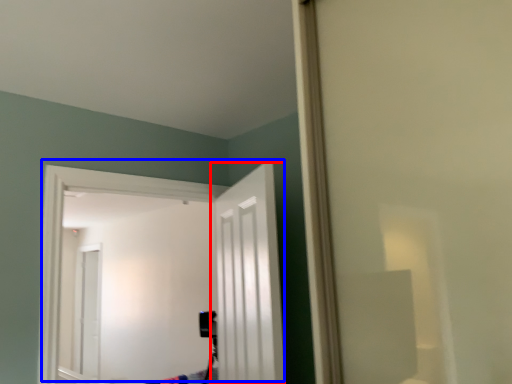
Question: Which object is further to the camera taking this photo, door (highlighted by a red box) or door (highlighted by a blue box)?

Choices:
 (A) door
 (B) door

Answer: (B)